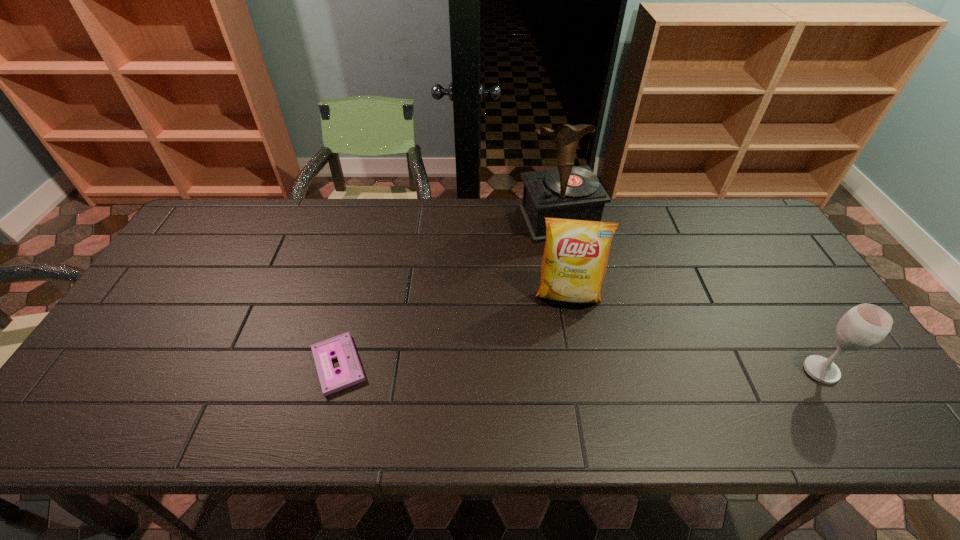
I want to click on the shortest object, so click(350, 373).

You are a GUI agent. You are given a task and a screenshot of the screen. Output one action in this format:
    pyautogui.click(x=<x>, y=<y>)
    Task: Click on the leftmost object
    The width and height of the screenshot is (960, 540).
    Given the screenshot: What is the action you would take?
    pyautogui.click(x=350, y=373)

This screenshot has height=540, width=960. What are the coordinates of `the third tallest object` in the screenshot? It's located at (864, 326).

What are the coordinates of `wineglass` in the screenshot? It's located at (864, 326).

Locate an element on the screen. Image resolution: width=960 pixels, height=540 pixels. crisp (potato chip) is located at coordinates pos(574,263).

Where is `phonograph_record`? The height and width of the screenshot is (540, 960). phonograph_record is located at coordinates (567, 192).

This screenshot has width=960, height=540. In order to click on the tallest object in this screenshot , I will do `click(567, 192)`.

The image size is (960, 540). Find the location of `blank space located on the right of the shortest object`. blank space located on the right of the shortest object is located at coordinates (530, 364).

Locate an element on the screen. vacant space located on the left of the rightmost object is located at coordinates (750, 370).

You are a GUI agent. You are given a task and a screenshot of the screen. Output one action in this format:
    pyautogui.click(x=<x>, y=<y>)
    Task: Click on the free spot located 0.190m on the front-facing side of the crisp (potato chip)
    
    Given the screenshot: What is the action you would take?
    pyautogui.click(x=567, y=372)